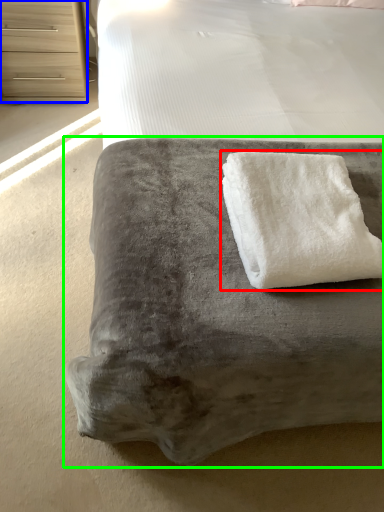
Question: Which object is positioned closest to towel (highlighted by a red box)? Select from chest of drawers (highlighted by a blue box) and furniture (highlighted by a green box).

Choices:
 (A) chest of drawers
 (B) furniture

Answer: (B)